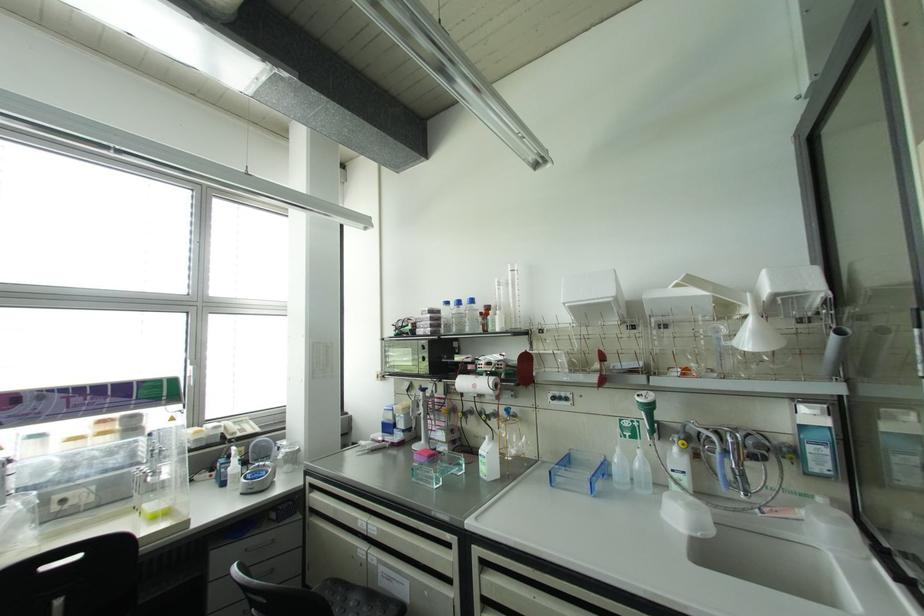
At what (x,y) coordinates should I click in order to perform the action: click on chrome faucet handle. Please return your answer as a coordinate pair (x, y). The image size is (924, 616). Looking at the image, I should click on (747, 448).